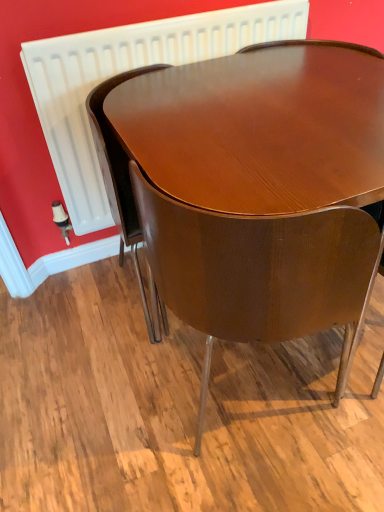
Question: Looking at their shapes, would you say glossy wood chair at center, the 2th chair viewed from the right, is wider or thinner than glossy wood chair at center, the second chair positioned from the left?

Choices:
 (A) thin
 (B) wide

Answer: (A)

Question: From a real-world perspective, is glossy wood chair at center, the 2th chair viewed from the right, physically located above or below glossy wood chair at center, which appears as the first chair when viewed from the right?

Choices:
 (A) above
 (B) below

Answer: (A)

Question: Based on their relative distances, which object is nearer to the glossy wood chair at center, the 2th chair viewed from the right?

Choices:
 (A) glossy wood chair at center, the second chair positioned from the left
 (B) white plastic radiator at upper center

Answer: (B)

Question: Estimate the real-world distances between objects in this image. Which object is closer to the white plastic radiator at upper center?

Choices:
 (A) glossy wood chair at center, the 2th chair viewed from the right
 (B) glossy wood chair at center, which appears as the first chair when viewed from the right

Answer: (A)